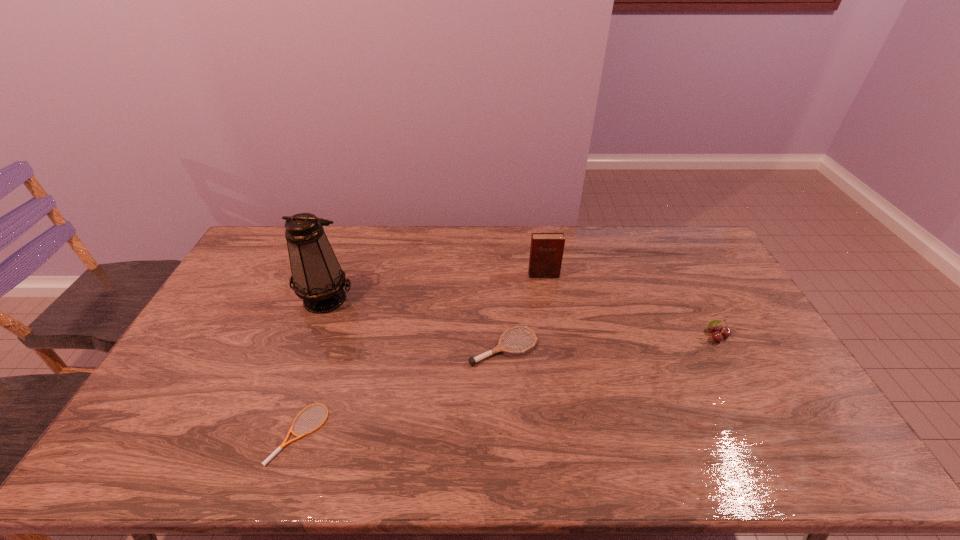
Where is `free space at the right edge`? This screenshot has height=540, width=960. free space at the right edge is located at coordinates (739, 328).

Image resolution: width=960 pixels, height=540 pixels. Find the location of `empty space between the second farthest object and the left tennis racket`. empty space between the second farthest object and the left tennis racket is located at coordinates (313, 366).

The width and height of the screenshot is (960, 540). In order to click on empty space between the cherry and the fourth shortest object in this screenshot , I will do `click(630, 305)`.

Identify the location of free spot between the cherry and the second farthest object. (520, 318).

The image size is (960, 540). What are the coordinates of `free point between the shortest object and the fourth tallest object` in the screenshot? It's located at (402, 390).

Find the location of a particular element. The height and width of the screenshot is (540, 960). free spot between the nearest object and the right tennis racket is located at coordinates (402, 390).

This screenshot has width=960, height=540. In order to click on free spot between the diary and the nearer tennis racket in this screenshot , I will do `click(422, 354)`.

Where is `unoccupied area between the diary and the shortest object`? unoccupied area between the diary and the shortest object is located at coordinates (422, 354).

Find the location of a particular element. unoccupied area between the farthest object and the right tennis racket is located at coordinates (523, 311).

You are a GUI agent. You are given a task and a screenshot of the screen. Output one action in this format:
    pyautogui.click(x=<x>, y=<y>)
    Task: Click on the free space between the farther tennis racket and the cherry
    The image size is (960, 540).
    Given the screenshot: What is the action you would take?
    pyautogui.click(x=610, y=342)